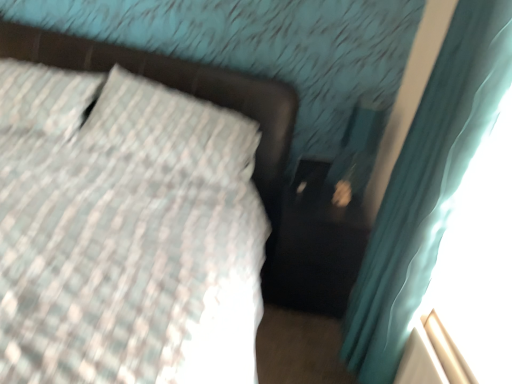
Question: Is teal fabric curtain at right in front of or behind matte black bed frame at upper left in the image?

Choices:
 (A) behind
 (B) front

Answer: (B)

Question: From a real-world perspective, is teal fabric curtain at right positioned above or below matte black bed frame at upper left?

Choices:
 (A) below
 (B) above

Answer: (B)

Question: Is teal fabric curtain at right spatially inside matte black bed frame at upper left, or outside of it?

Choices:
 (A) outside
 (B) inside

Answer: (A)

Question: From the image's perspective, is matte black bed frame at upper left positioned above or below teal fabric curtain at right?

Choices:
 (A) above
 (B) below

Answer: (A)

Question: In terms of height, does matte black bed frame at upper left look taller or shorter compared to teal fabric curtain at right?

Choices:
 (A) short
 (B) tall

Answer: (A)

Question: From a real-world perspective, relative to teal fabric curtain at right, is matte black bed frame at upper left vertically above or below?

Choices:
 (A) above
 (B) below

Answer: (B)

Question: Would you say matte black bed frame at upper left is inside or outside teal fabric curtain at right?

Choices:
 (A) outside
 (B) inside

Answer: (A)